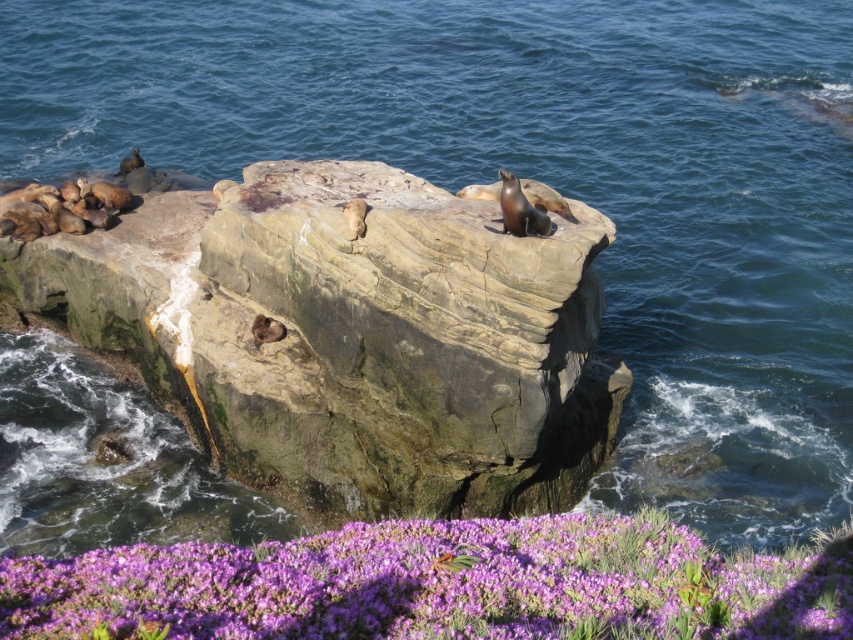
Based on the photo, you are a photographer trying to capture the sea lions resting on the rocky outcrop. You notice two points marked on your map as potential vantage points. The first is at point (x=326, y=269) and the second at point (x=564, y=568). Which point is closer to you, the photographer?

Point (x=326, y=269) is closer to you because it is further to the viewer than point (x=564, y=568).

You are a photographer aiming to capture the purple matte flowers at lower center without the smooth rock at center blocking the view. Is this possible based on their positions?

The purple matte flowers at lower center is behind the smooth rock at center, so the smooth rock at center would block the view of the purple matte flowers at lower center. Therefore, it is not possible to capture the purple matte flowers at lower center without the smooth rock at center blocking the view.

You are a photographer planning to capture a closeup of the purple matte flowers at lower center without the smooth rock at center appearing in the frame. Can you do this if you position yourself directly in front of the flowers?

The smooth rock at center might be wider than purple matte flowers at lower center, so there is a possibility that the rock could still be in the frame even when positioned directly in front of the flowers. To ensure the rock is out of view, you might need to adjust your angle or move further away to avoid capturing it.